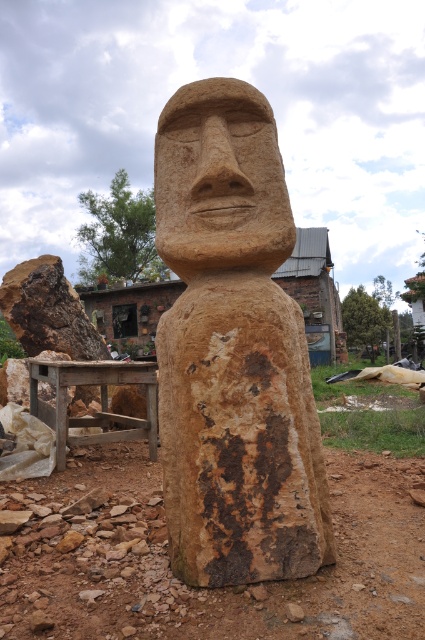
You are an artist planning to transport both the brown stone statue at center and the brown stone face at center using a truck with a 1.5 meter wide loading bay. Based on their sizes, which object can fit through the loading bay without needing to be rotated?

The brown stone face at center can fit through the loading bay since its width is smaller than the brown stone statue at center, which is too wide for the 1.5 meter limit.

You are an archaeologist examining the sculpture. You notice two parts labeled as the brown stone statue at center and the brown stone face at center. Which part is taller?

The brown stone statue at center is taller than the brown stone face at center.